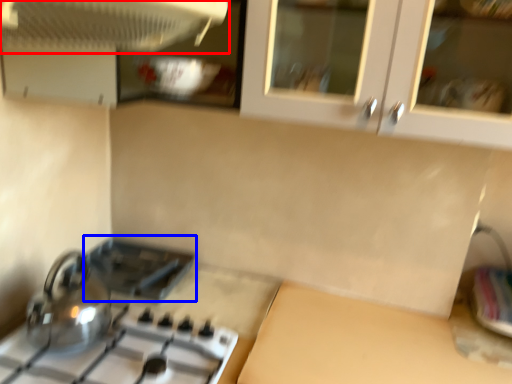
Question: Which of the following is the closest to the observer, kitchen appliance (highlighted by a red box) or appliance (highlighted by a blue box)?

Choices:
 (A) kitchen appliance
 (B) appliance

Answer: (A)